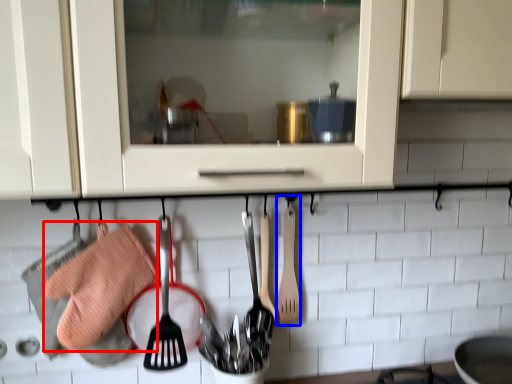
Question: Which point is further to the camera, material (highlighted by a red box) or spatula (highlighted by a blue box)?

Choices:
 (A) material
 (B) spatula

Answer: (B)